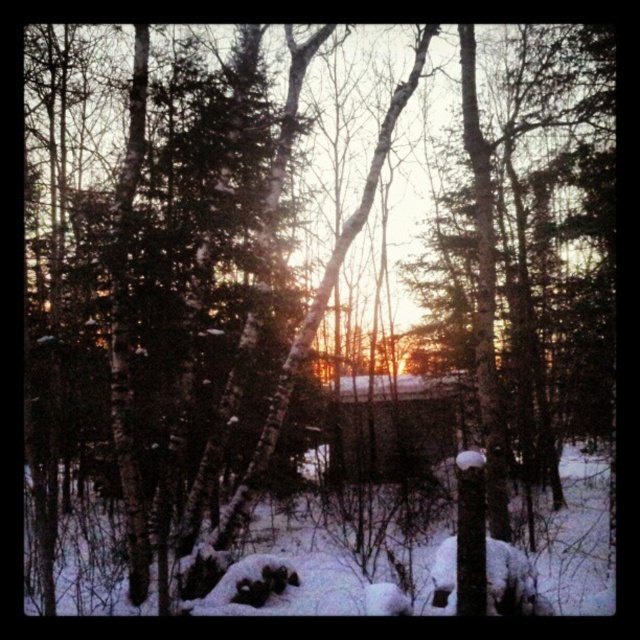
Is white fluffy snow at center closer to camera compared to brown wooden cabin at center?

Yes.

Which of these two, white fluffy snow at center or brown wooden cabin at center, stands shorter?

brown wooden cabin at center

Is point (83, 545) behind point (371, 452)?

No, it is not.

The width and height of the screenshot is (640, 640). Identify the location of white fluffy snow at center. (564, 547).